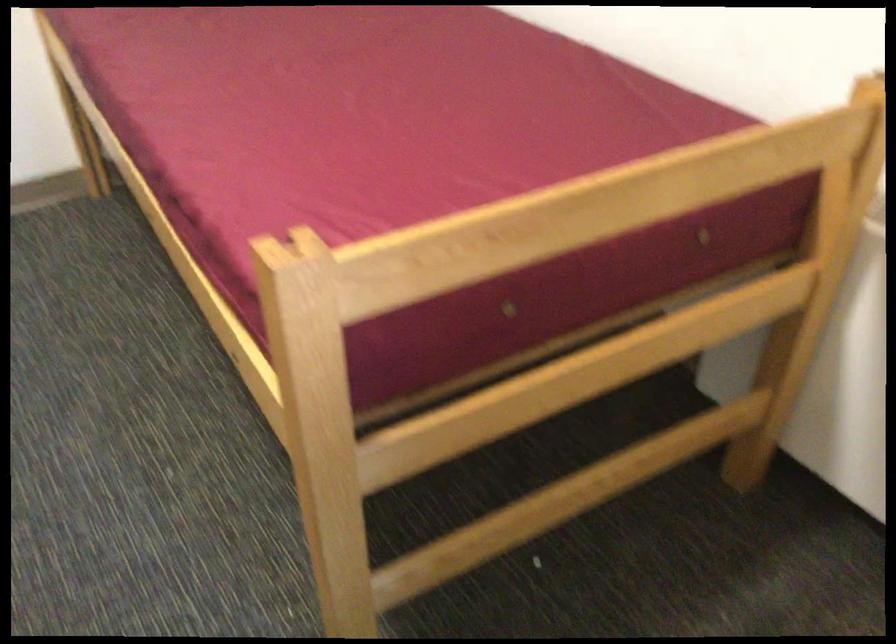
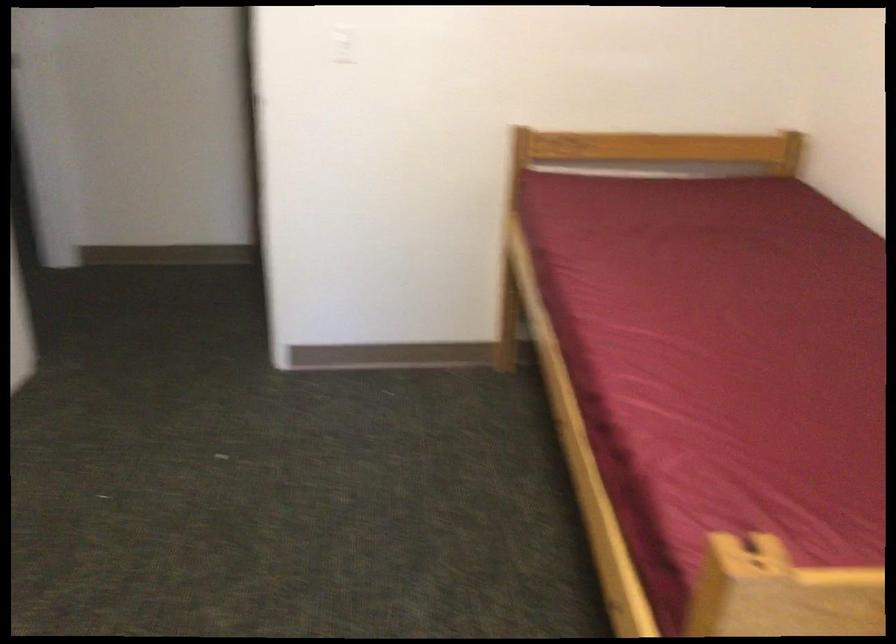
Locate, in the second image, the point that corresponds to (334,267) in the first image.

(805, 603)